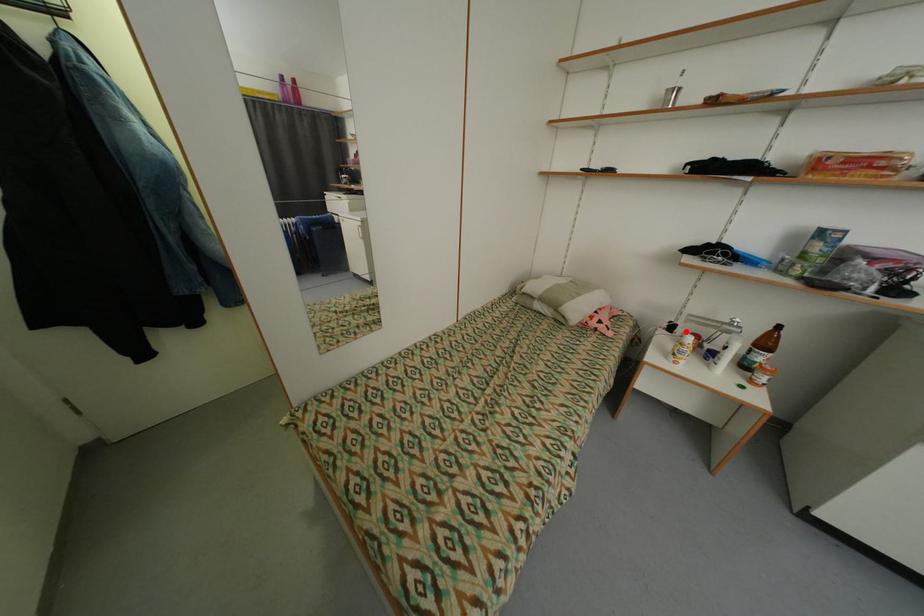
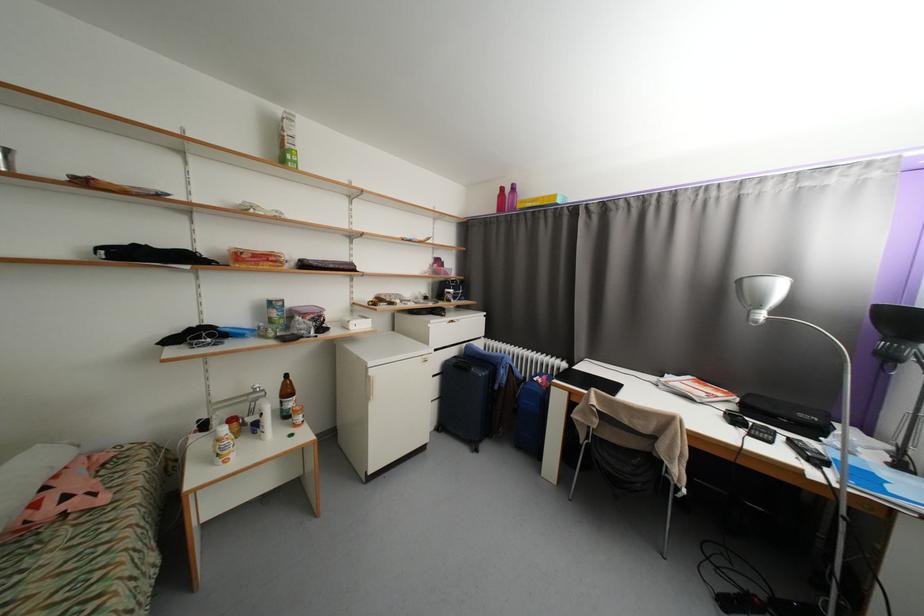
Question: I am providing you with two images of the same scene from different viewpoints. In image1, a red point is highlighted. Considering the same 3D point in image2, which of the following is correct?

Choices:
 (A) It is closer
 (B) It is farther

Answer: (B)